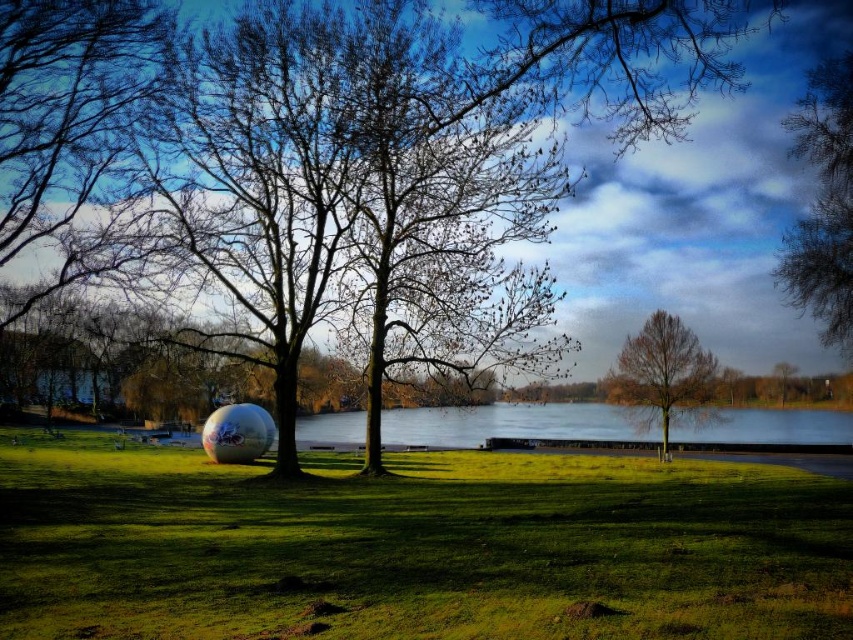
You are a gardener planning to plant a new tree in the grassy area. You want to place it so that it won not block the view of the bare branches at upper right from the green matte tree at center. Where should you plant the new tree?

The green matte tree at center is to the left of the bare branches at upper right. To avoid blocking the view, the new tree should be planted to the right side of the green matte tree at center, ensuring it stays between the existing tree and the bare branches at upper right.

You are standing at the edge of the grassy area near the water and want to take a photo of the large, spherical sculpture with a floral design. If you move 10 meters towards the point at coordinates point (51, 26), will you be closer to the sculpture?

The distance of point (51, 26) from viewer is 18.05 meters. Moving 10 meters towards that point would place you 8.05 meters away from it. However, the question does not provide information about the sculpture distance from the viewer or its position relative to the point. Therefore, it is impossible to determine if moving towards the point would bring you closer to the sculpture.

You are a landscape architect designing a walking path that must pass between the green matte tree at center and the large spherical sculpture with a floral design. Based on their positions, which object is closer to the path if the path is planned to run along the y coordinate 0.3?

The green matte tree at center is located at point (334, 125), so the y coordinate of the path is 0.3. The distance between the tree and the path can be calculated by the difference in the y coordinates. The tree is at 0.393, so the vertical distance is 0.093. The spherical sculpture is at center left, but its exact coordinates are not provided. However, since the tree is explicitly mentioned in the objects, the answer should focus on the tree. Wait, the problem states that the path must pass between the